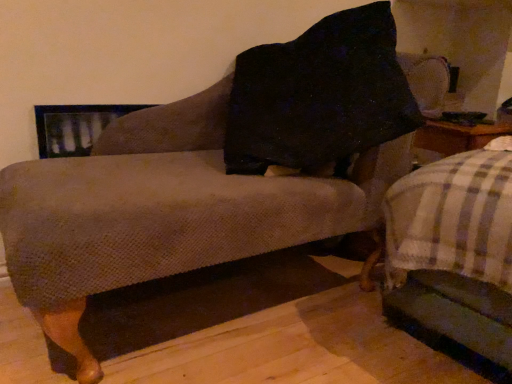
Image resolution: width=512 pixels, height=384 pixels. Identify the location of plaid fabric bed frame at lower right. [455, 249].

What do you see at coordinates (455, 249) in the screenshot? I see `plaid fabric bed frame at lower right` at bounding box center [455, 249].

Locate an element on the screen. This screenshot has height=384, width=512. plaid fabric bed frame at lower right is located at coordinates (455, 249).